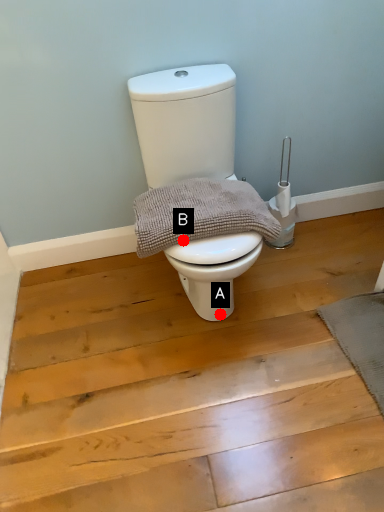
Question: Two points are circled on the image, labeled by A and B beside each circle. Which point is further to the camera?

Choices:
 (A) A is further
 (B) B is further

Answer: (A)